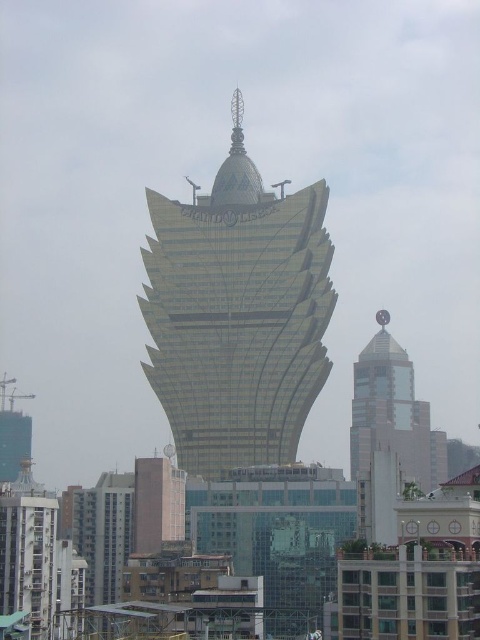
Question: Observing the image, what is the correct spatial positioning of gold metallic tower at center in reference to glassy reflective tower at center?

Choices:
 (A) right
 (B) left

Answer: (B)

Question: Does gold metallic tower at center lie behind glassy reflective tower at center?

Choices:
 (A) no
 (B) yes

Answer: (A)

Question: Which object appears closest to the camera in this image?

Choices:
 (A) glassy reflective tower at center
 (B) gold metallic tower at center

Answer: (B)

Question: Which of the following is the farthest from the observer?

Choices:
 (A) glassy reflective tower at center
 (B) gold metallic tower at center

Answer: (A)

Question: Is gold metallic tower at center smaller than glassy reflective tower at center?

Choices:
 (A) no
 (B) yes

Answer: (A)